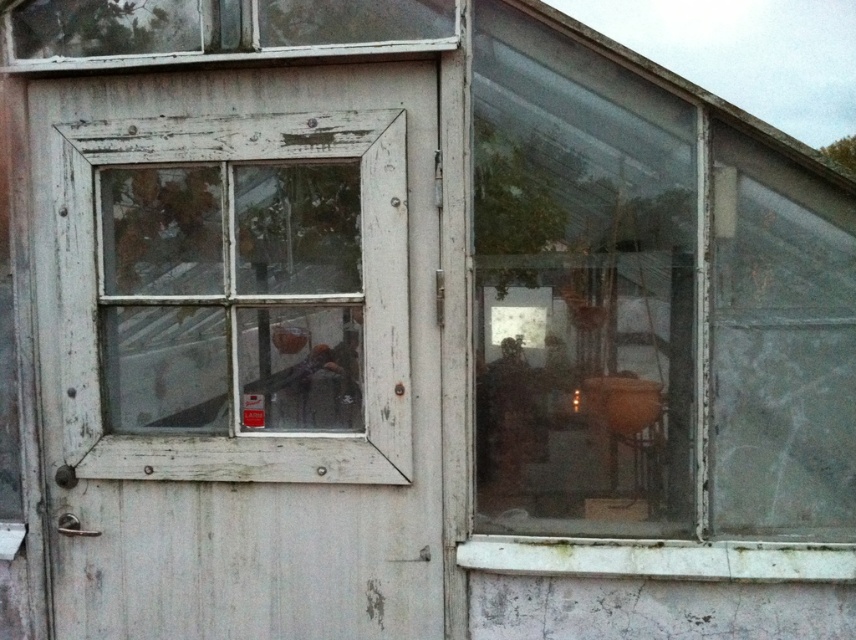
You are a gardener who needs to enter the greenhouse. The white wood screen door at left and the transparent glass window at upper right are both visible. Which one is bigger in size?

The white wood screen door at left is larger in size compared to the transparent glass window at upper right according to the description.

Consider the image. You are standing outside the greenhouse and want to look through the transparent glass window at upper right to see the plants inside. To do this, do you need to go around the white wood screen door at left?

The white wood screen door at left is located below the transparent glass window at upper right, so you can look through the transparent glass window at upper right without needing to go around the white wood screen door at left since it is positioned below it.

Based on the photo, you are a gardener trying to enter the greenhouse. You notice the white wood screen door at left and the transparent glass window at upper right. Which one is wider so you can carry a large plant pot through?

The white wood screen door at left is wider than the transparent glass window at upper right, so you should use the white wood screen door at left to carry the large plant pot through.